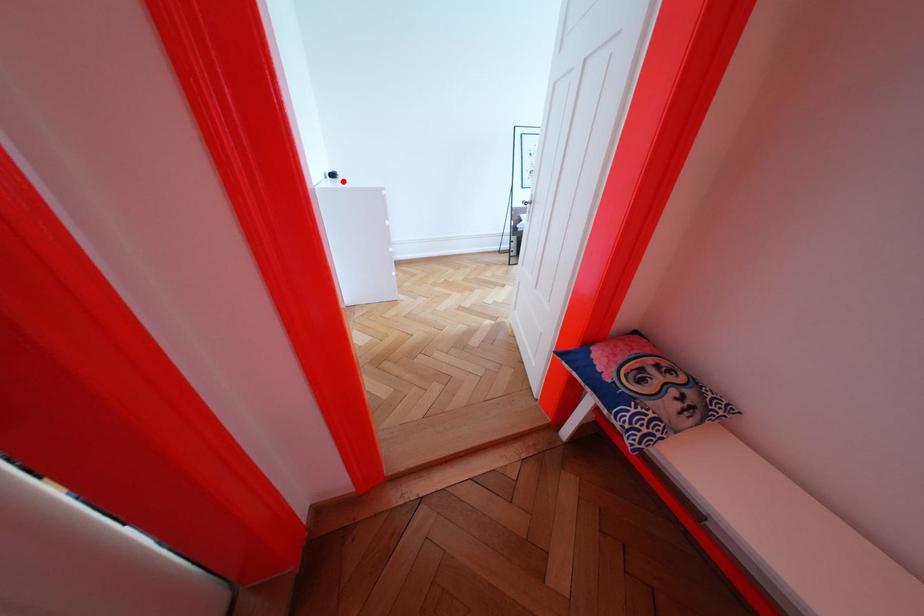
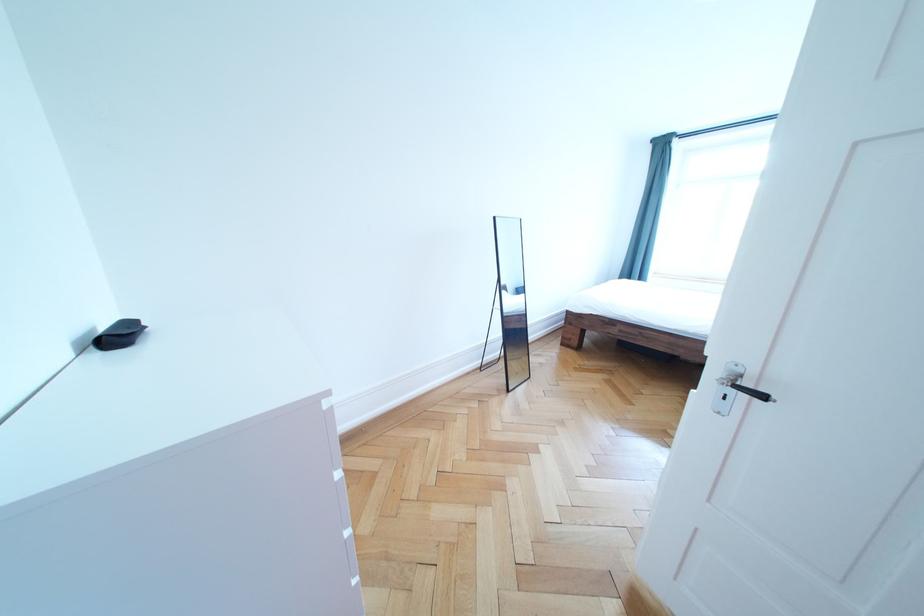
In the second image, find the point that corresponds to the highlighted location in the first image.

(128, 344)